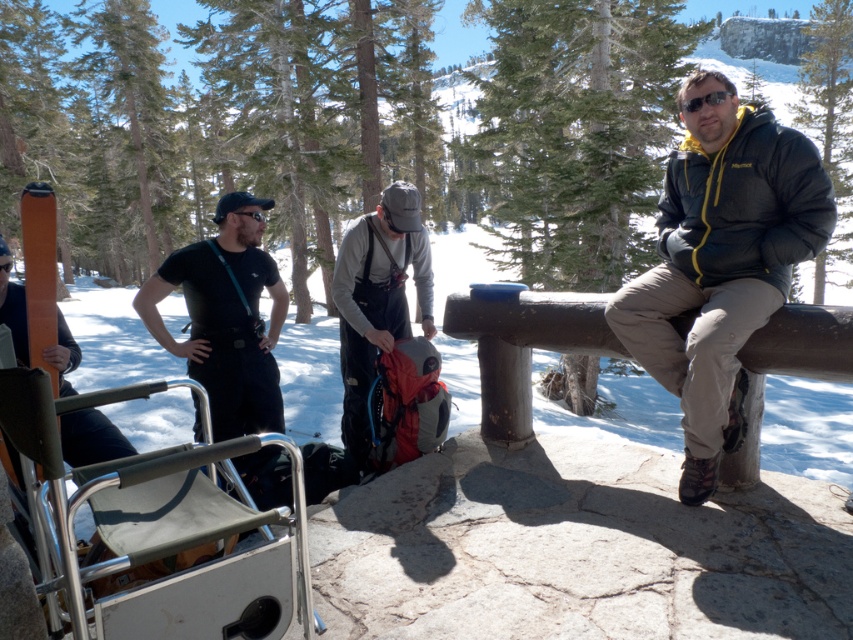
Can you confirm if matte black t-shirt at center is positioned to the right of gray fabric backpack at center?

Incorrect, matte black t-shirt at center is not on the right side of gray fabric backpack at center.

Who is shorter, matte black t-shirt at center or gray fabric backpack at center?

Standing shorter between the two is gray fabric backpack at center.

Which is behind, point (225, 241) or point (364, 314)?

The point (364, 314) is behind.

This screenshot has width=853, height=640. Find the location of `matte black t-shirt at center`. matte black t-shirt at center is located at coordinates (225, 317).

Which is above, matte black jacket at right or gray fabric backpack at center?

matte black jacket at right is above.

Who is more distant from viewer, (740,193) or (399,305)?

The point (399,305) is behind.

The width and height of the screenshot is (853, 640). Find the location of `matte black jacket at right`. matte black jacket at right is located at coordinates (720, 260).

In the scene shown: Is matte black jacket at right below matte black t-shirt at center?

Actually, matte black jacket at right is above matte black t-shirt at center.

Between point (688, 387) and point (222, 218), which one is positioned behind?

The point (222, 218) is more distant.

Measure the distance between matte black jacket at right and camera.

matte black jacket at right and camera are 2.57 meters apart.

Image resolution: width=853 pixels, height=640 pixels. I want to click on matte black jacket at right, so click(x=720, y=260).